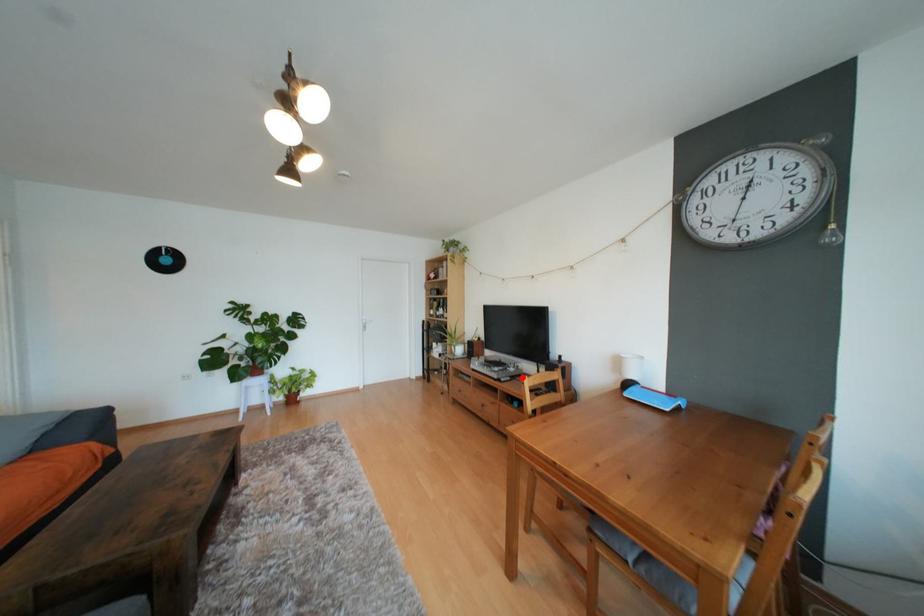
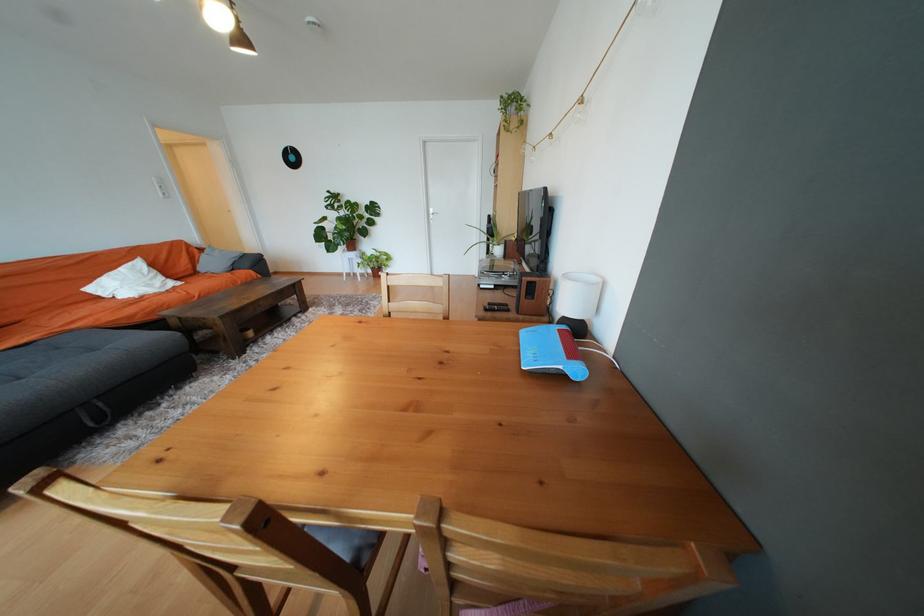
In the second image, find the point that corresponds to the highlighted location in the first image.

(517, 288)